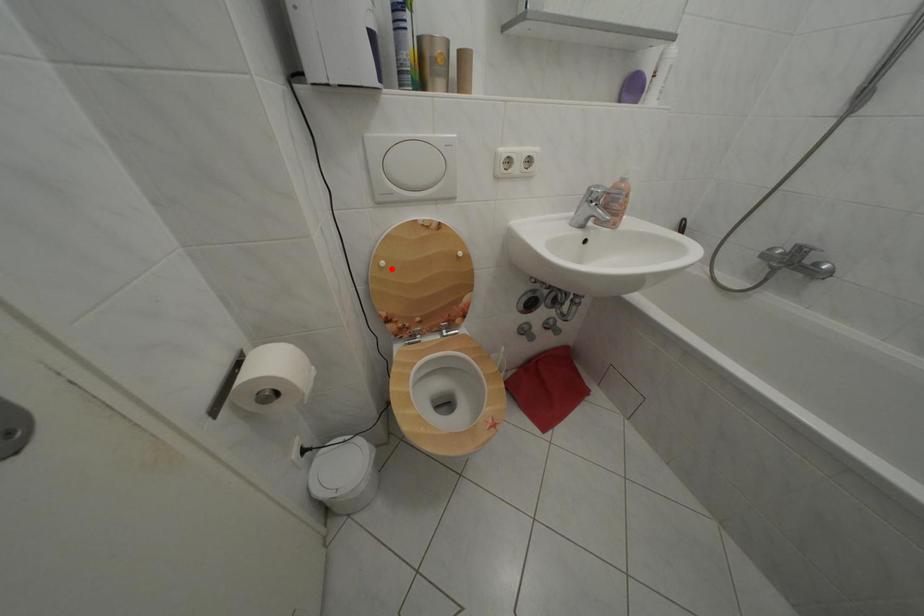
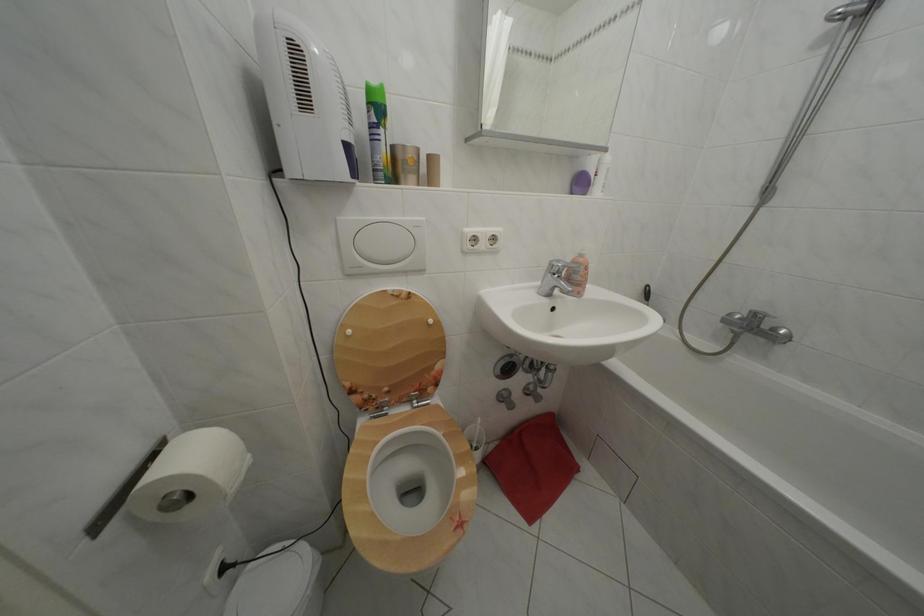
The point at the highlighted location is marked in the first image. Where is the corresponding point in the second image?

(358, 338)